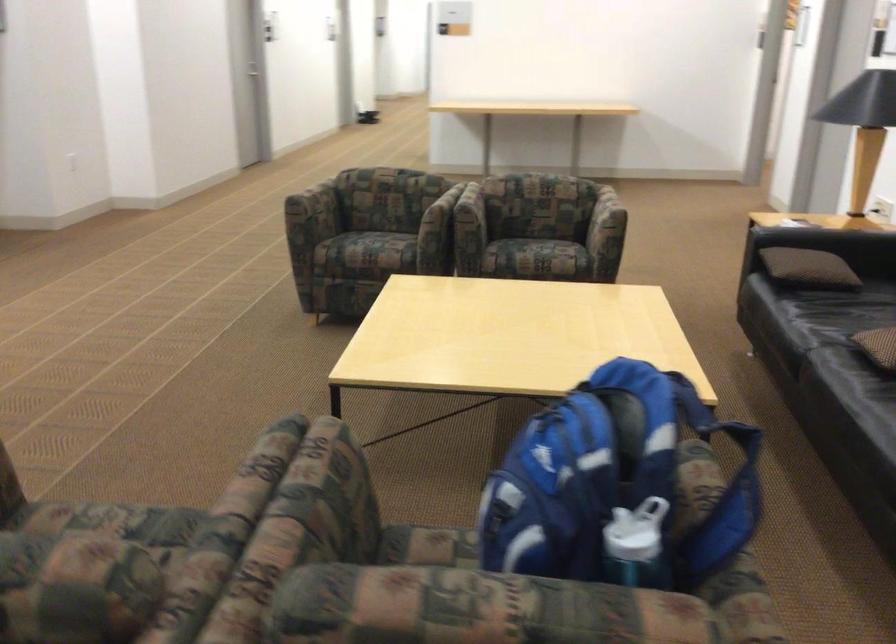
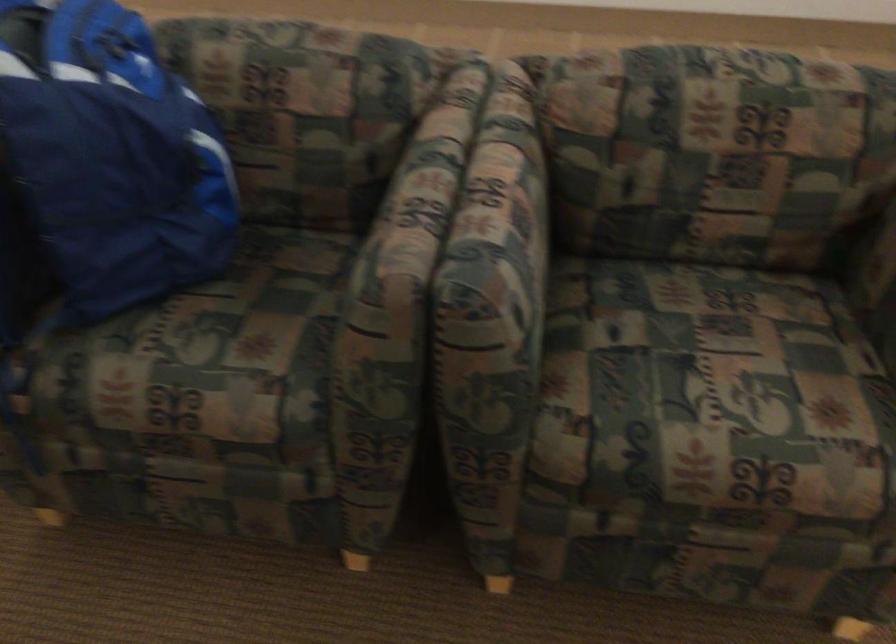
Where in the second image is the point corresponding to point (117, 538) from the first image?

(691, 357)